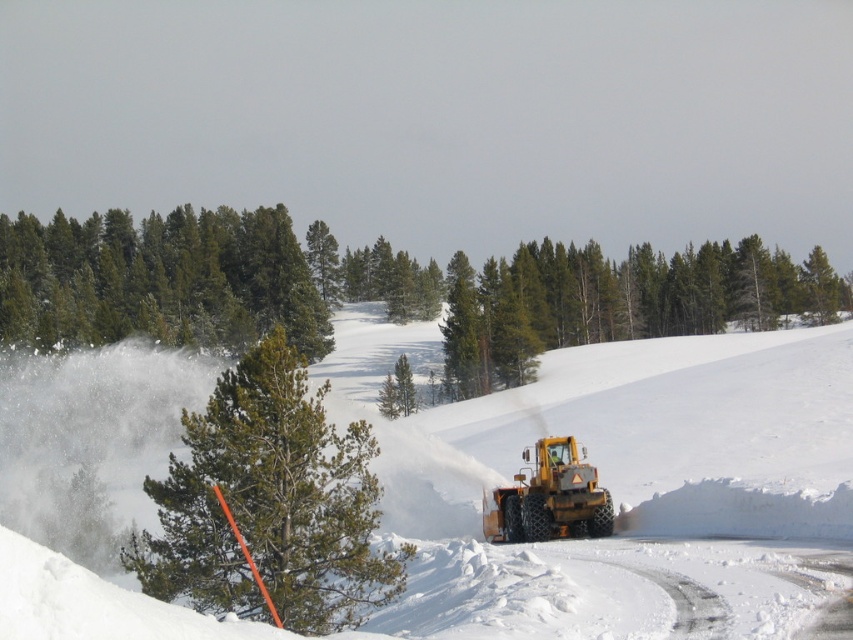
Question: Does white fluffy snow at center come behind green textured pine tree at center?

Choices:
 (A) no
 (B) yes

Answer: (A)

Question: Is white fluffy snow at center thinner than green matte trees at upper left?

Choices:
 (A) no
 (B) yes

Answer: (A)

Question: Does green textured pine tree at center appear on the right side of yellow rubber plow at center?

Choices:
 (A) no
 (B) yes

Answer: (A)

Question: Which point is closer to the camera taking this photo?

Choices:
 (A) (399, 433)
 (B) (790, 289)
 (C) (399, 552)
 (D) (566, 525)

Answer: (C)

Question: Among these objects, which one is farthest from the camera?

Choices:
 (A) yellow rubber plow at center
 (B) green textured pine tree at center

Answer: (A)

Question: Which of the following is the closest to the observer?

Choices:
 (A) (213, 518)
 (B) (672, 547)
 (C) (234, 282)

Answer: (A)